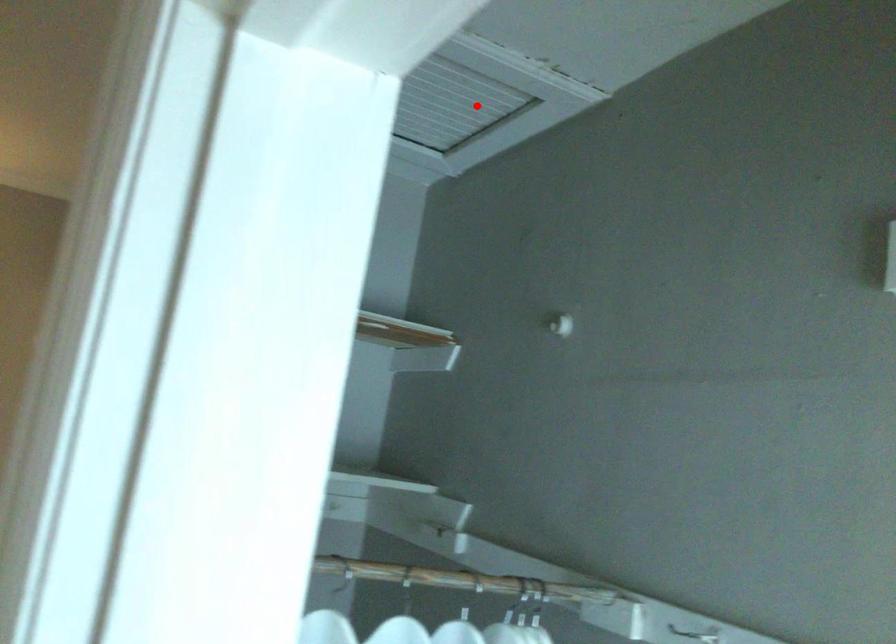
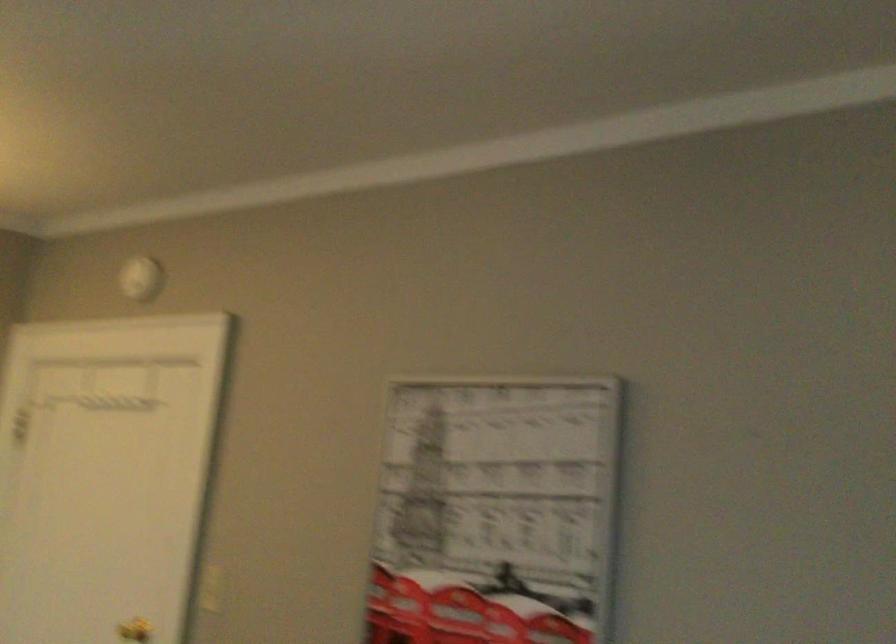
Question: I am providing you with two images of the same scene from different viewpoints. A red point is marked on the first image. At the location where the point appears in image 1, is it still visible in image 2?

Choices:
 (A) Yes
 (B) No

Answer: (B)